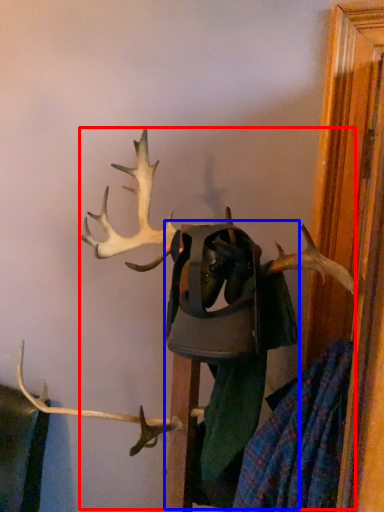
Question: Which object appears farthest to the camera in this image, deer (highlighted by a red box) or clothing (highlighted by a blue box)?

Choices:
 (A) deer
 (B) clothing

Answer: (B)